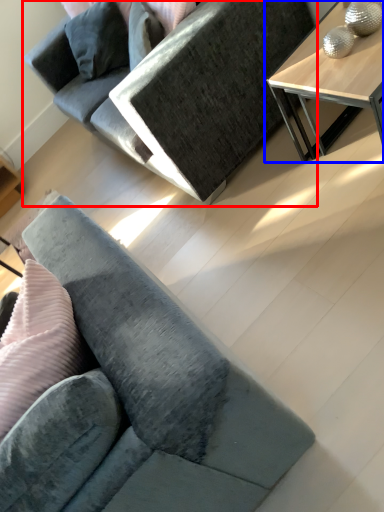
Question: Which point is further to the camera, studio couch (highlighted by a red box) or table (highlighted by a blue box)?

Choices:
 (A) studio couch
 (B) table

Answer: (A)